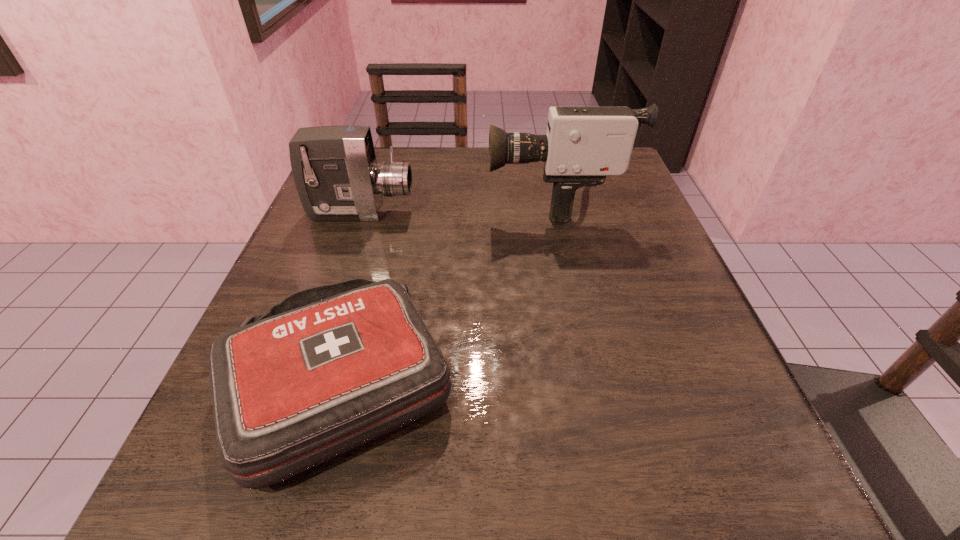
Locate an element on the screen. the taller camcorder is located at coordinates (582, 145).

You are a GUI agent. You are given a task and a screenshot of the screen. Output one action in this format:
    pyautogui.click(x=<x>, y=<y>)
    Task: Click on the rightmost object
    The width and height of the screenshot is (960, 540).
    Given the screenshot: What is the action you would take?
    pyautogui.click(x=582, y=145)

Identify the location of the shorter camcorder. (336, 174).

Locate an element on the screen. The image size is (960, 540). the left camcorder is located at coordinates (336, 174).

Find the location of a particular element. This screenshot has height=540, width=960. the shortest object is located at coordinates (329, 368).

Find the location of a particular element. the first-aid kit is located at coordinates (329, 368).

Where is `vacant space located 0.280m on the recording direction of the tallest object`? vacant space located 0.280m on the recording direction of the tallest object is located at coordinates (359, 200).

Identify the location of free space located on the recording direction of the tallest object. The image size is (960, 540). (373, 200).

Find the location of a particular element. Image resolution: width=960 pixels, height=540 pixels. blank space located 0.340m on the recording direction of the tallest object is located at coordinates coord(332,200).

Where is `free space located at the front of the second tallest object, highlighting the lens`? The height and width of the screenshot is (540, 960). free space located at the front of the second tallest object, highlighting the lens is located at coordinates (446, 213).